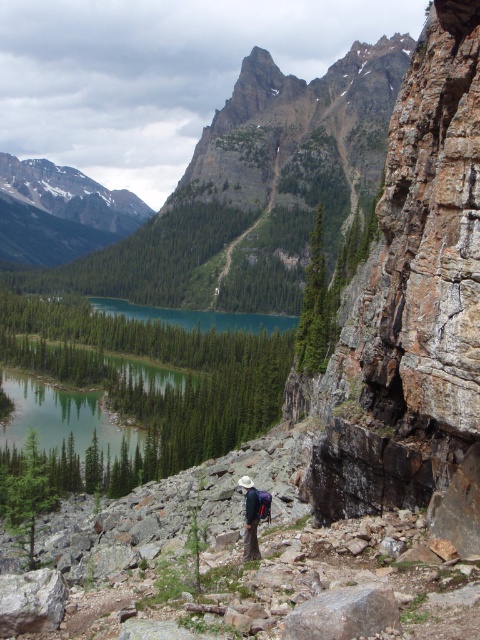
Is point (232, 403) positioned before point (358, 593)?

No, (232, 403) is behind (358, 593).

Is point (78, 301) farther from camera compared to point (344, 616)?

That is True.

Locate an element on the screen. teal glossy water at center is located at coordinates (153, 385).

Which of these two, gray rough rock at lower center or dark blue fabric backpack at center, stands taller?

dark blue fabric backpack at center is taller.

The height and width of the screenshot is (640, 480). I want to click on gray rough rock at lower center, so click(x=344, y=612).

At what (x,y) coordinates should I click in order to perform the action: click on gray rough rock at lower center. Please return your answer as a coordinate pair (x, y). Looking at the image, I should click on tap(344, 612).

This screenshot has width=480, height=640. Describe the element at coordinates (416, 308) in the screenshot. I see `rusty brown rock at right` at that location.

Does rusty brown rock at right have a smaller size compared to dark blue fabric backpack at center?

No, rusty brown rock at right is not smaller than dark blue fabric backpack at center.

What do you see at coordinates (416, 308) in the screenshot? I see `rusty brown rock at right` at bounding box center [416, 308].

Identify the location of rusty brown rock at right. The image size is (480, 640). (416, 308).